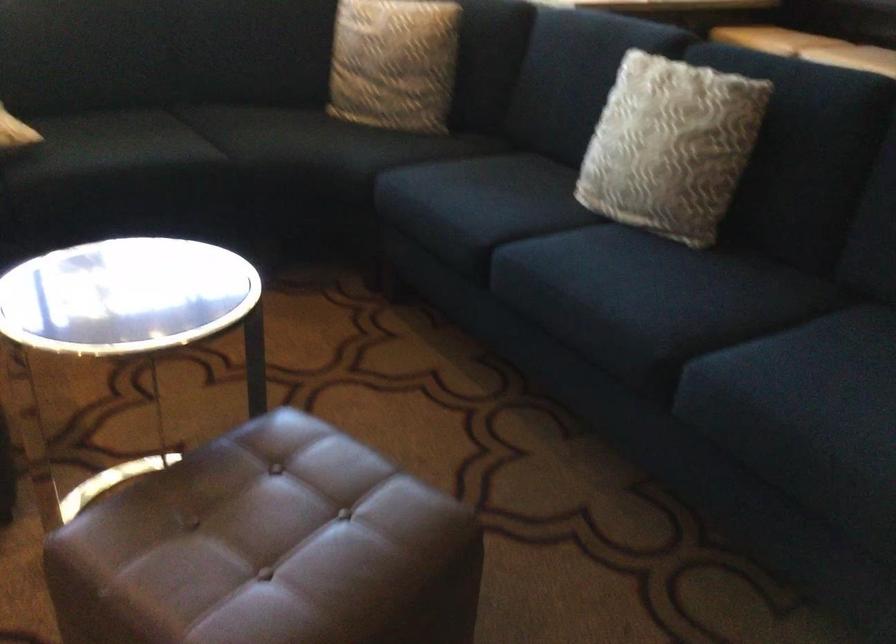
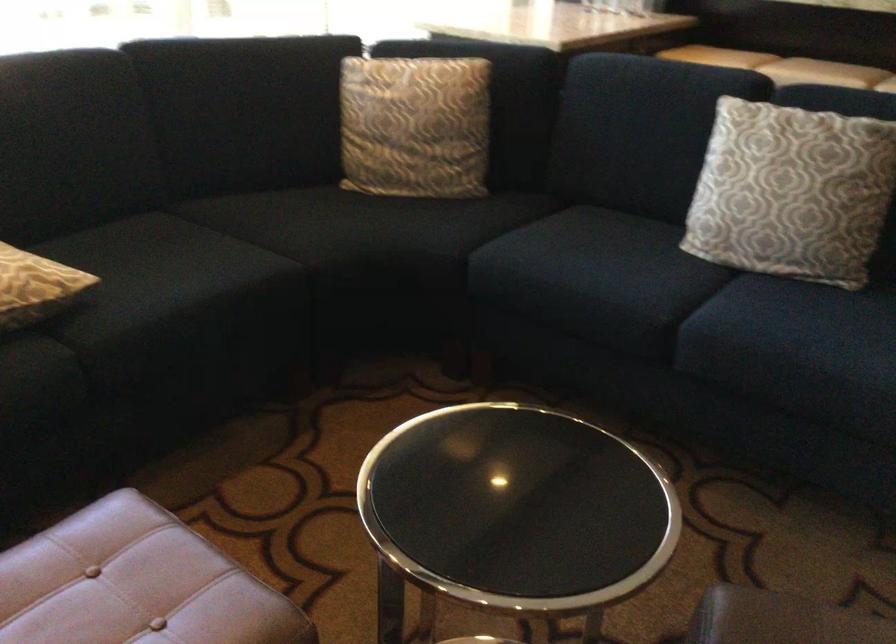
The point at (656, 146) is marked in the first image. Where is the corresponding point in the second image?

(791, 192)